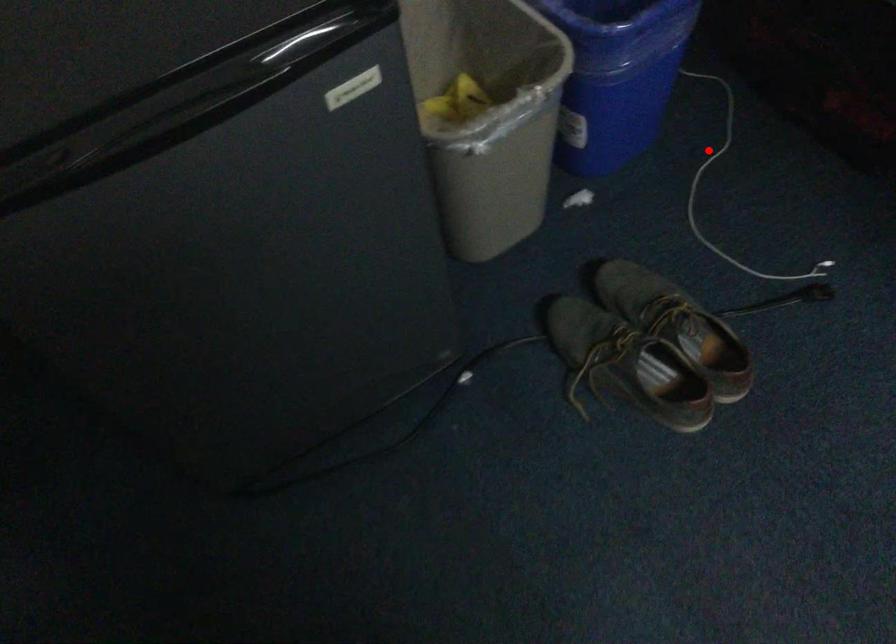
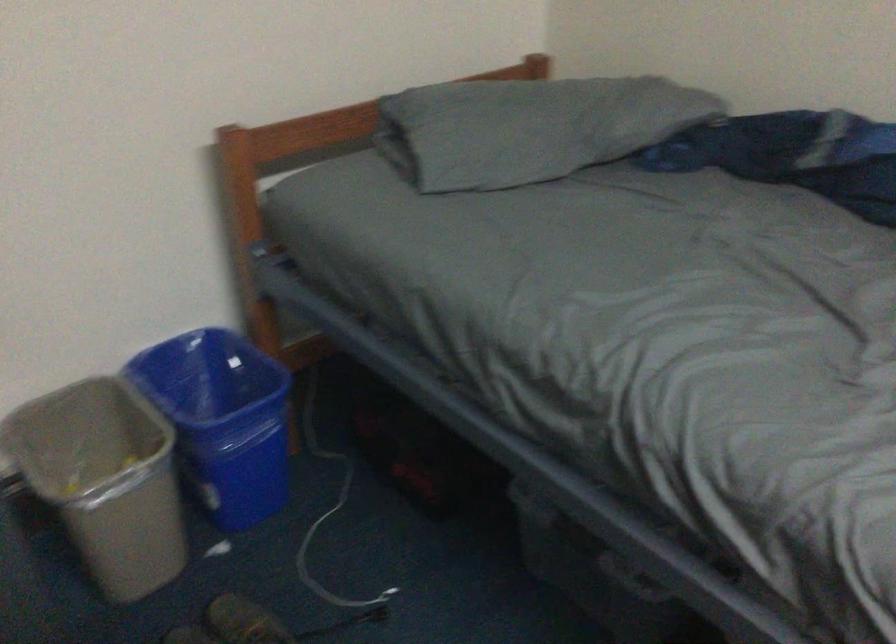
Find the pixel in the second image that matches the highlighted location in the first image.

(328, 509)